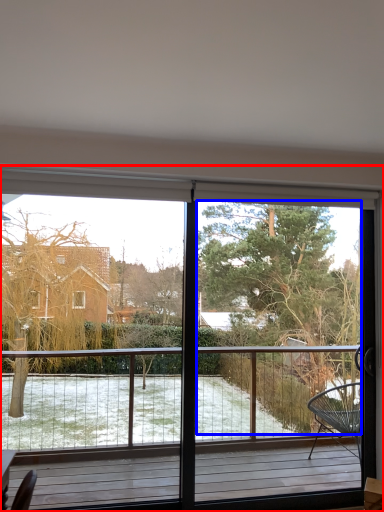
Question: Among these objects, which one is nearest to the camera, window (highlighted by a red box) or tree (highlighted by a blue box)?

Choices:
 (A) window
 (B) tree

Answer: (A)